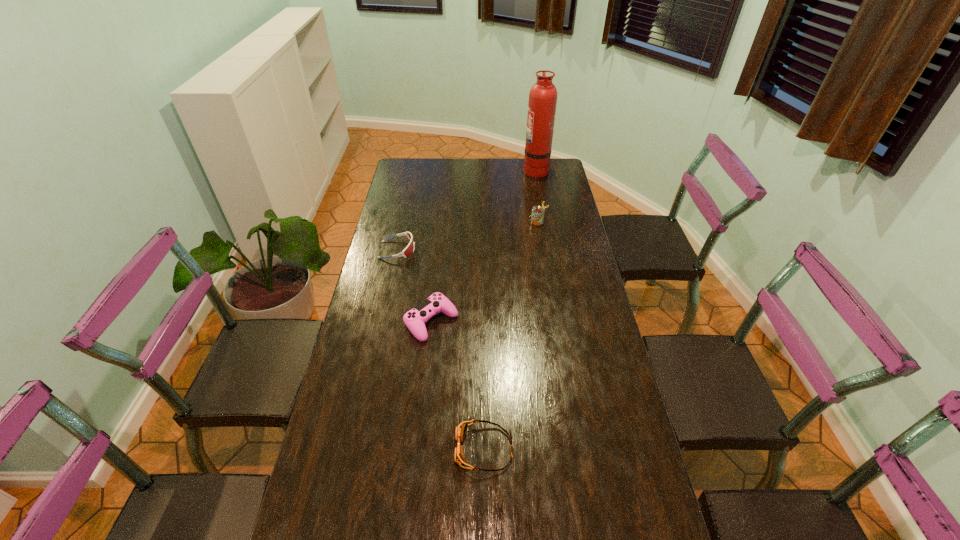
The height and width of the screenshot is (540, 960). I want to click on free space located on the label side of the farthest object, so click(x=469, y=169).

You are a GUI agent. You are given a task and a screenshot of the screen. Output one action in this format:
    pyautogui.click(x=<x>, y=<y>)
    Task: Click on the vacant point located 0.220m on the label side of the farthest object
    The height and width of the screenshot is (540, 960).
    Given the screenshot: What is the action you would take?
    pyautogui.click(x=479, y=169)

This screenshot has width=960, height=540. I want to click on vacant space located 0.360m on the label side of the farthest object, so click(451, 169).

Image resolution: width=960 pixels, height=540 pixels. I want to click on free space located on the back of the fourth shortest object, so click(x=530, y=172).

Where is `free space located 0.190m on the front of the second object from left to right`? This screenshot has height=540, width=960. free space located 0.190m on the front of the second object from left to right is located at coordinates (423, 396).

Find the location of a particular element. This screenshot has width=960, height=540. vacant space located 0.170m on the front-facing side of the taller goggles is located at coordinates (458, 250).

The height and width of the screenshot is (540, 960). Identify the location of blank space located 0.230m with the lenses facing forward on the shortest object. (368, 448).

Image resolution: width=960 pixels, height=540 pixels. In order to click on free space located with the lenses facing forward on the shortest object in this screenshot , I will do `click(360, 448)`.

Locate an element on the screen. The image size is (960, 540). free space located with the lenses facing forward on the shortest object is located at coordinates (425, 448).

Identify the location of object that is at the far edge. Image resolution: width=960 pixels, height=540 pixels. (542, 103).